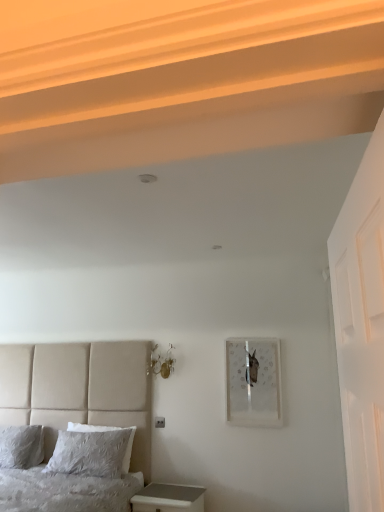
Question: Can you confirm if metallic glass sconces at upper center is wider than matte glass picture frame at upper right?

Choices:
 (A) no
 (B) yes

Answer: (B)

Question: Is metallic glass sconces at upper center closer to camera compared to matte glass picture frame at upper right?

Choices:
 (A) no
 (B) yes

Answer: (A)

Question: Considering the relative sizes of metallic glass sconces at upper center and matte glass picture frame at upper right in the image provided, is metallic glass sconces at upper center thinner than matte glass picture frame at upper right?

Choices:
 (A) yes
 (B) no

Answer: (B)

Question: Is metallic glass sconces at upper center located outside matte glass picture frame at upper right?

Choices:
 (A) no
 (B) yes

Answer: (B)

Question: Is metallic glass sconces at upper center oriented towards matte glass picture frame at upper right?

Choices:
 (A) no
 (B) yes

Answer: (A)

Question: Is metallic glass sconces at upper center bigger or smaller than white textured pillow at lower left, which is the 1th pillow from right to left?

Choices:
 (A) big
 (B) small

Answer: (B)

Question: From a real-world perspective, relative to white textured pillow at lower left, which is the second pillow from left to right, is metallic glass sconces at upper center vertically above or below?

Choices:
 (A) below
 (B) above

Answer: (B)

Question: Is metallic glass sconces at upper center wider or thinner than white textured pillow at lower left, which is the 1th pillow from right to left?

Choices:
 (A) thin
 (B) wide

Answer: (B)

Question: Is metallic glass sconces at upper center taller or shorter than white textured pillow at lower left, which is the 1th pillow from right to left?

Choices:
 (A) tall
 (B) short

Answer: (B)

Question: Do you think textured gray pillow at lower left, the 2th bed positioned from the front, is within white glossy nightstand at lower left, or outside of it?

Choices:
 (A) inside
 (B) outside

Answer: (B)

Question: Considering their positions, is textured gray pillow at lower left, which is the 1th bed from back to front, located in front of or behind white glossy nightstand at lower left?

Choices:
 (A) behind
 (B) front

Answer: (A)

Question: From a real-world perspective, is textured gray pillow at lower left, the 2th bed positioned from the front, above or below white glossy nightstand at lower left?

Choices:
 (A) above
 (B) below

Answer: (A)

Question: Considering the positions of textured gray pillow at lower left, which is the 1th bed from back to front, and white glossy nightstand at lower left in the image, is textured gray pillow at lower left, which is the 1th bed from back to front, wider or thinner than white glossy nightstand at lower left?

Choices:
 (A) wide
 (B) thin

Answer: (B)

Question: Is beige fabric bed at lower left, the first bed from the front, situated inside metallic glass sconces at upper center or outside?

Choices:
 (A) outside
 (B) inside

Answer: (A)

Question: Is beige fabric bed at lower left, the first bed from the front, to the left or to the right of metallic glass sconces at upper center in the image?

Choices:
 (A) right
 (B) left

Answer: (B)